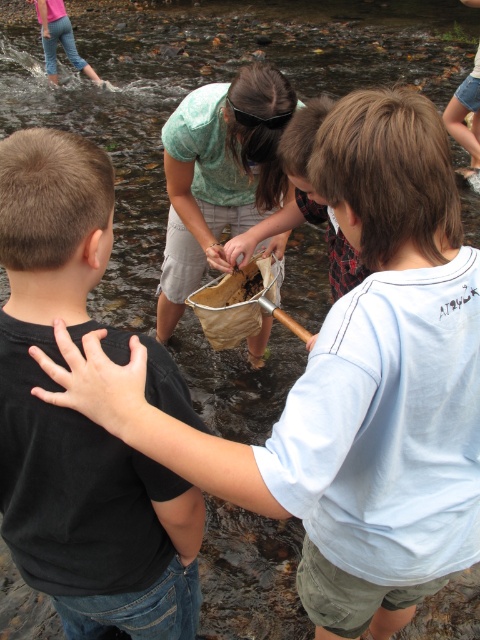
What do you see at coordinates (79, 417) in the screenshot?
I see `black matte shirt at left` at bounding box center [79, 417].

Is point (34, 193) less distant than point (477, 88)?

Yes, point (34, 193) is closer to viewer.

Does point (85, 474) come farther from viewer compared to point (453, 118)?

No, it is not.

Identify the location of black matte shirt at left. This screenshot has height=640, width=480. (79, 417).